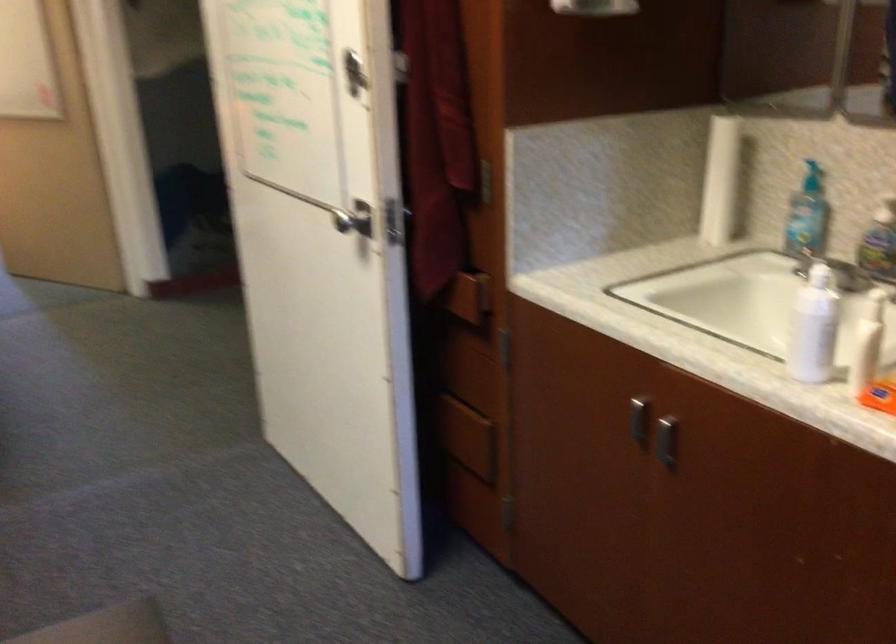
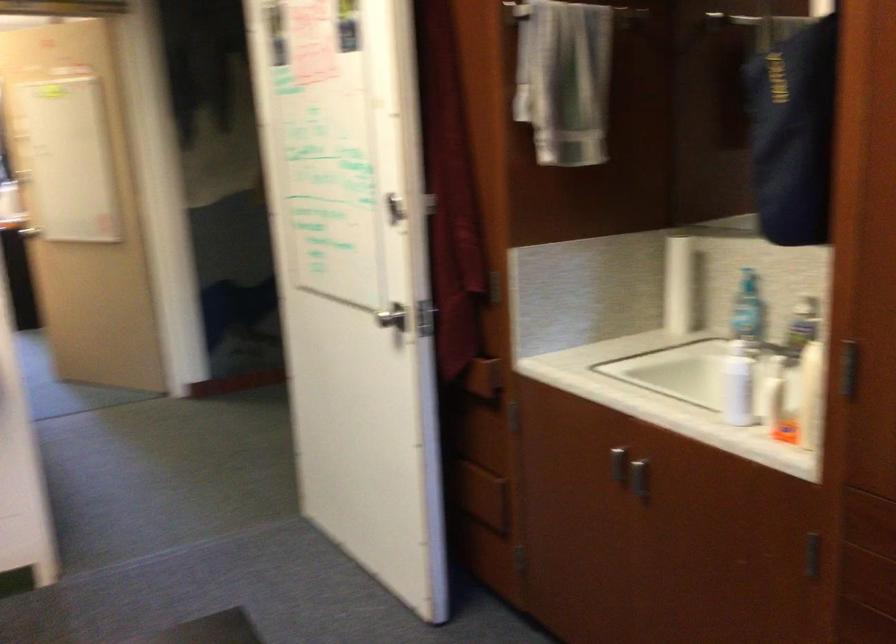
Locate, in the second image, the point that corresponds to [659,437] in the first image.

(634, 477)